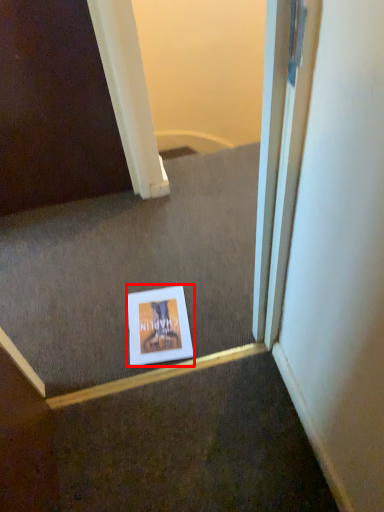
Question: From the image's perspective, what is the correct spatial relationship of picture frame (annotated by the red box) in relation to stairwell?

Choices:
 (A) above
 (B) below

Answer: (B)